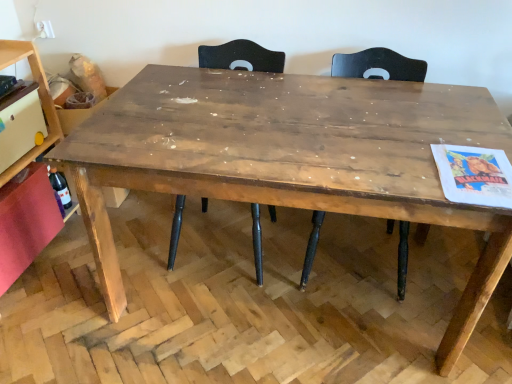
Question: Is matte black chair at upper center, the second chair when ordered from left to right, placed right next to translucent glass bottle at lower left?

Choices:
 (A) no
 (B) yes

Answer: (A)

Question: From the image's perspective, is matte black chair at upper center, the second chair when ordered from left to right, on translucent glass bottle at lower left?

Choices:
 (A) yes
 (B) no

Answer: (A)

Question: From a real-world perspective, is matte black chair at upper center, placed as the 1th chair when sorted from right to left, physically below translucent glass bottle at lower left?

Choices:
 (A) no
 (B) yes

Answer: (A)

Question: Can you confirm if matte black chair at upper center, placed as the 1th chair when sorted from right to left, is positioned to the left of translucent glass bottle at lower left?

Choices:
 (A) yes
 (B) no

Answer: (B)

Question: From a real-world perspective, is matte black chair at upper center, the second chair when ordered from left to right, on top of translucent glass bottle at lower left?

Choices:
 (A) no
 (B) yes

Answer: (B)

Question: Is point (264, 61) positioned closer to the camera than point (172, 74)?

Choices:
 (A) closer
 (B) farther

Answer: (B)

Question: Is dark brown wood chair at center, which is the 2th chair in right-to-left order, in front of or behind rustic wood table at center in the image?

Choices:
 (A) front
 (B) behind

Answer: (B)

Question: Considering the positions of dark brown wood chair at center, which is the 2th chair in right-to-left order, and rustic wood table at center in the image, is dark brown wood chair at center, which is the 2th chair in right-to-left order, bigger or smaller than rustic wood table at center?

Choices:
 (A) big
 (B) small

Answer: (B)

Question: From their relative heights in the image, would you say dark brown wood chair at center, which is the 1th chair from left to right, is taller or shorter than rustic wood table at center?

Choices:
 (A) tall
 (B) short

Answer: (A)

Question: Is dark brown wood chair at center, which is the 1th chair from left to right, to the left or to the right of wooden shelf at left, acting as the second shelf starting from the top, in the image?

Choices:
 (A) right
 (B) left

Answer: (A)

Question: Is point (215, 54) closer or farther from the camera than point (14, 61)?

Choices:
 (A) farther
 (B) closer

Answer: (A)

Question: From a real-world perspective, is dark brown wood chair at center, which is the 2th chair in right-to-left order, physically located above or below wooden shelf at left, acting as the second shelf starting from the top?

Choices:
 (A) below
 (B) above

Answer: (A)

Question: From the image's perspective, is dark brown wood chair at center, which is the 1th chair from left to right, above or below wooden shelf at left, the 1th shelf in the bottom-to-top sequence?

Choices:
 (A) below
 (B) above

Answer: (B)

Question: Choose the correct answer: Is rustic wood table at center inside translucent glass bottle at lower left or outside it?

Choices:
 (A) outside
 (B) inside

Answer: (A)

Question: Looking at their shapes, would you say rustic wood table at center is wider or thinner than translucent glass bottle at lower left?

Choices:
 (A) wide
 (B) thin

Answer: (A)